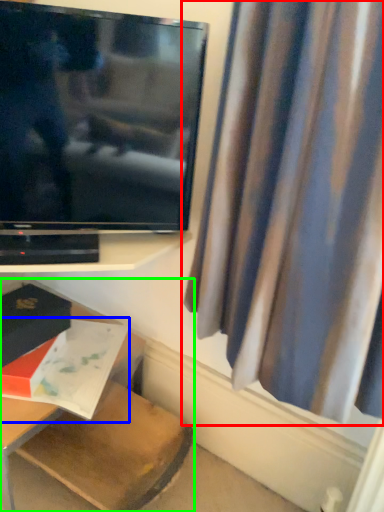
Question: Based on their relative distances, which object is farther from curtain (highlighted by a red box)? Choose from book (highlighted by a blue box) and furniture (highlighted by a green box).

Choices:
 (A) book
 (B) furniture

Answer: (B)